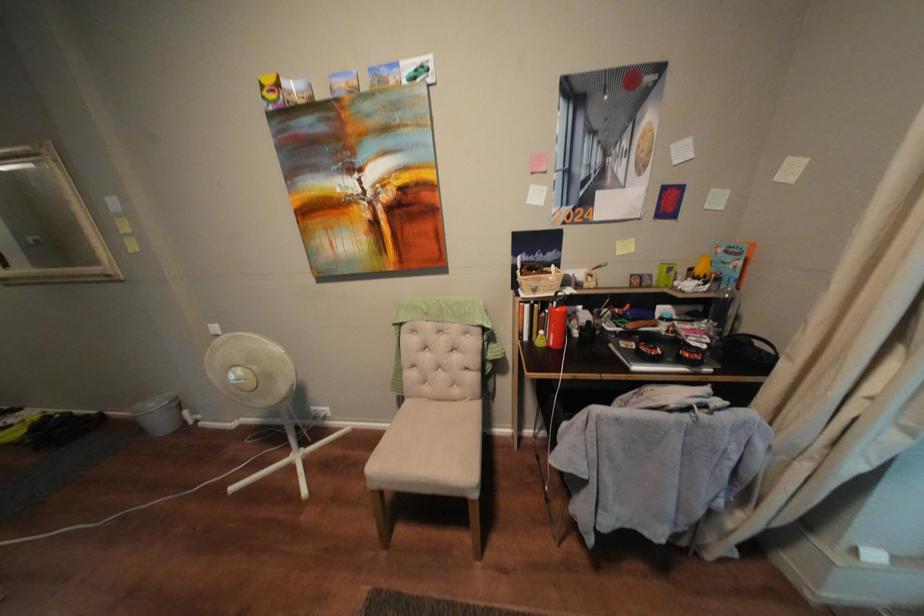
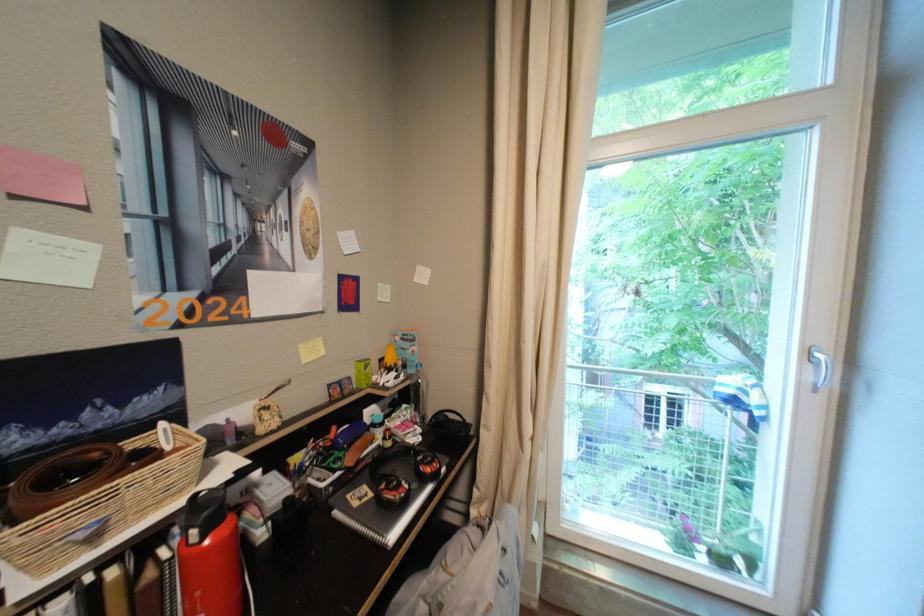
Question: The images are taken continuously from a first-person perspective. In which direction is your viewpoint rotating?

Choices:
 (A) Left
 (B) Right
 (C) Up
 (D) Down

Answer: (B)